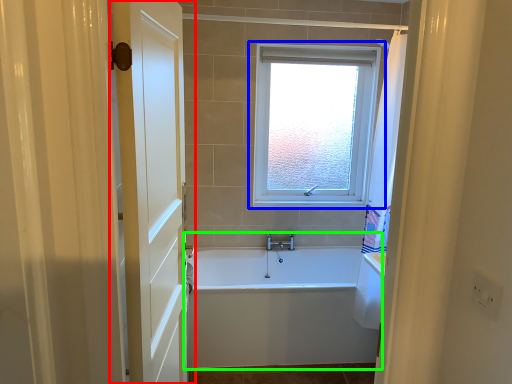
Question: Which is nearer to the door (highlighted by a red box)? window (highlighted by a blue box) or bathtub (highlighted by a green box).

Choices:
 (A) window
 (B) bathtub

Answer: (B)